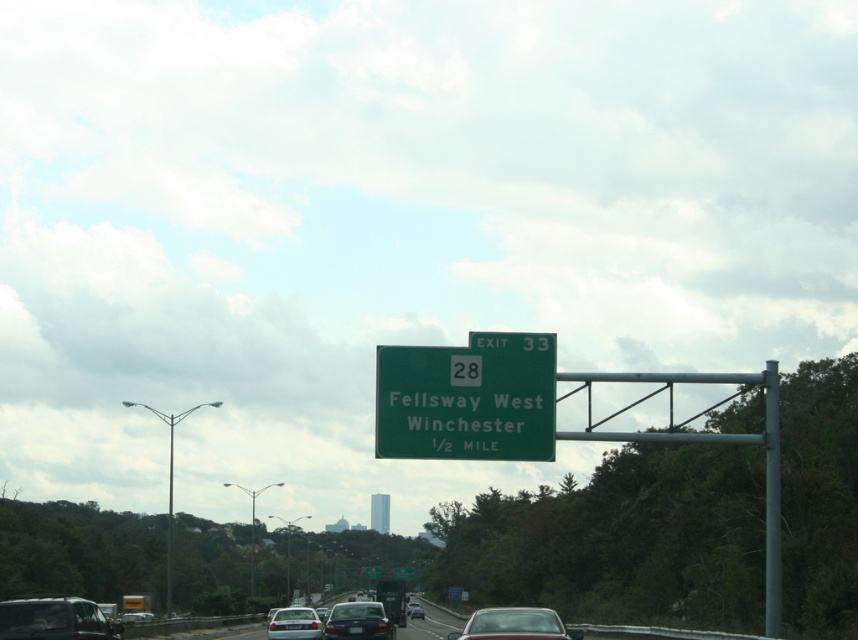
You are a driver approaching the highway exit. You see the green road sign mounted on a metal pole in the foreground and the matte silver sedan at center represented by point (514, 625). Based on their positions, which object is closer to you?

The green road sign mounted on a metal pole is closer to you because it is in the foreground, while the matte silver sedan at center represented by point (514, 625) is further away in the background.

You are a driver approaching the green matte sign at center and the white glossy sedan at center. Which object appears wider from your perspective?

The green matte sign at center appears wider because its width is larger than the white glossy sedan at center.